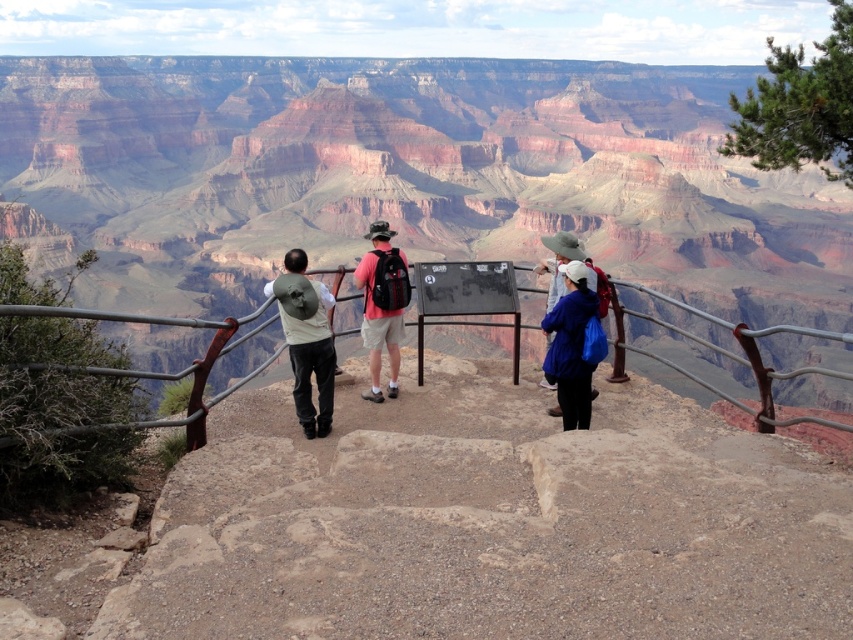
You are planning to take a photo of the matte green backpack at center and the matte pink shirt at center. Which object should you focus on first if you want to capture both in the frame without moving the camera?

You should focus on the matte green backpack at center first because it is smaller in size compared to the matte pink shirt at center, ensuring it is properly framed before adjusting for the larger object.

You are a tour guide leading a group at the Grand Canyon overlook. You notice a matte green backpack at center and a matte pink shirt at center. Your safety protocol requires that all items must be within 5 meters of each other to ensure group cohesion. Are these two items within the required distance?

The matte green backpack at center is 4.38 meters from the matte pink shirt at center, which is within the 5 meters requirement. Therefore, these items are within the required distance for group cohesion.

You are standing at the viewpoint overlooking the Grand Canyon. You see the rustic rock canyon at center and the metallic gray railing at center. Which object is closer to your left side?

The rustic rock canyon at center is closer to your left side because it is positioned to the left of the metallic gray railing at center.